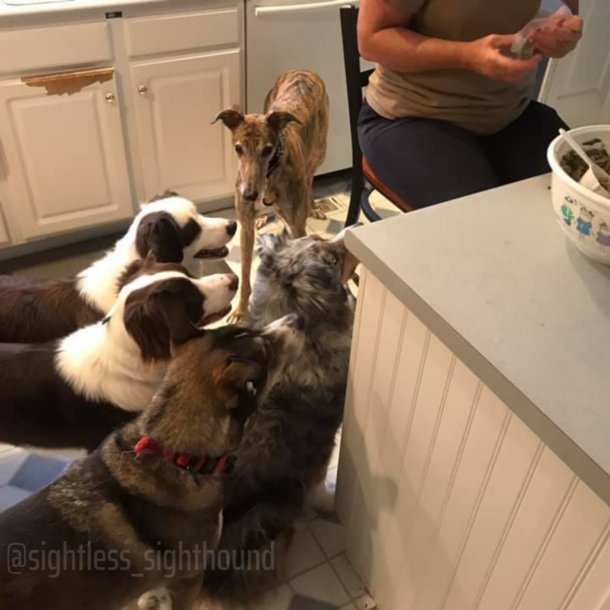
At what (x,y) coordinates should I click in order to perform the action: click on blue diamond in tile flooring. Please return your answer as a coordinate pair (x, y). The image size is (610, 610). Looking at the image, I should click on (30, 474).